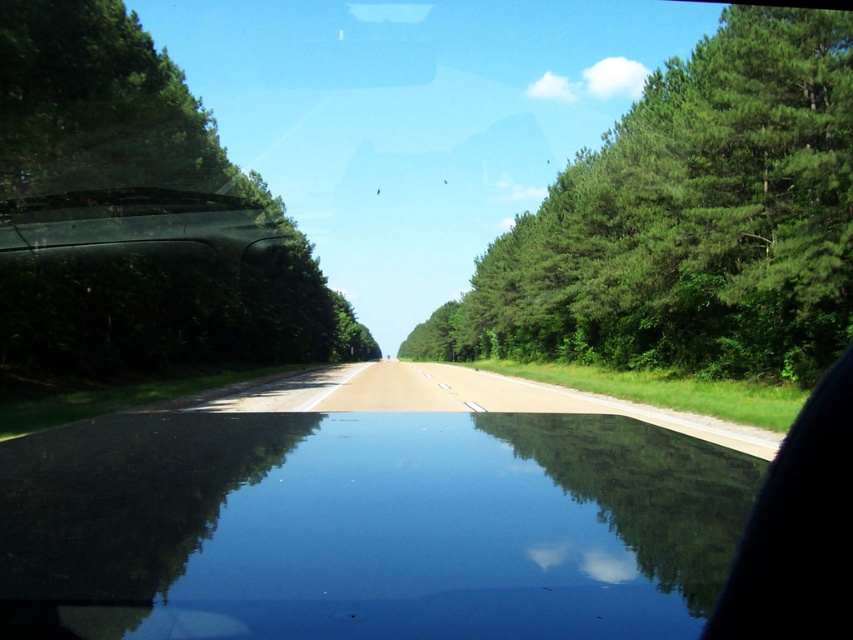
Question: Which object appears farthest from the camera in this image?

Choices:
 (A) green leafy tree at left
 (B) green leafy trees at right

Answer: (B)

Question: Is green leafy trees at right thinner than green leafy tree at left?

Choices:
 (A) no
 (B) yes

Answer: (A)

Question: Which point is closer to the camera?

Choices:
 (A) (28, 60)
 (B) (607, 221)

Answer: (A)

Question: Is green leafy trees at right above green leafy tree at left?

Choices:
 (A) no
 (B) yes

Answer: (B)

Question: Can you confirm if green leafy trees at right is positioned to the right of green leafy tree at left?

Choices:
 (A) yes
 (B) no

Answer: (A)